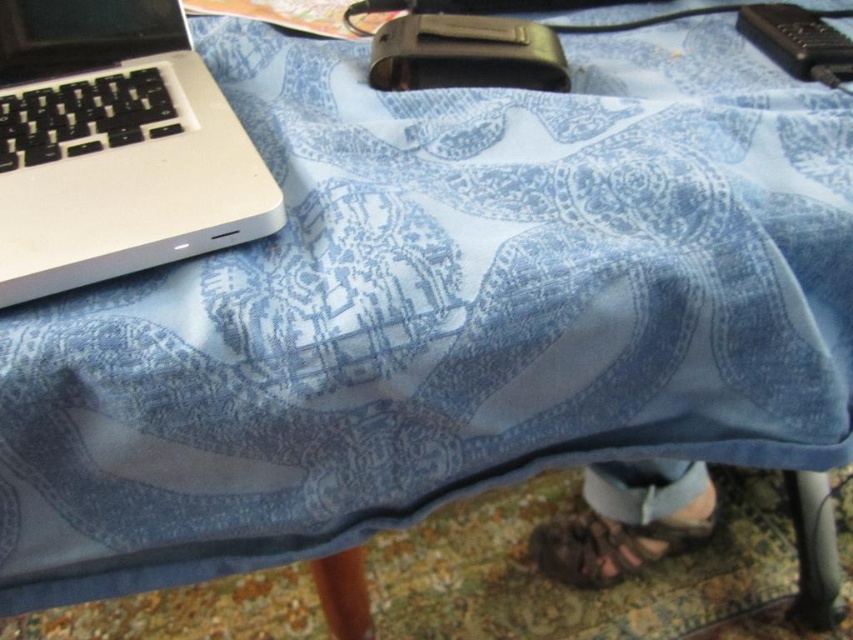
Question: Can you confirm if white matte laptop at left is bigger than denim pants at lower right?

Choices:
 (A) no
 (B) yes

Answer: (B)

Question: Among these points, which one is nearest to the camera?

Choices:
 (A) (91, 106)
 (B) (543, 544)

Answer: (A)

Question: Can you confirm if white matte laptop at left is smaller than denim pants at lower right?

Choices:
 (A) no
 (B) yes

Answer: (A)

Question: Among these points, which one is nearest to the camera?

Choices:
 (A) (1, 284)
 (B) (598, 580)

Answer: (A)

Question: Does white matte laptop at left appear on the left side of denim pants at lower right?

Choices:
 (A) no
 (B) yes

Answer: (B)